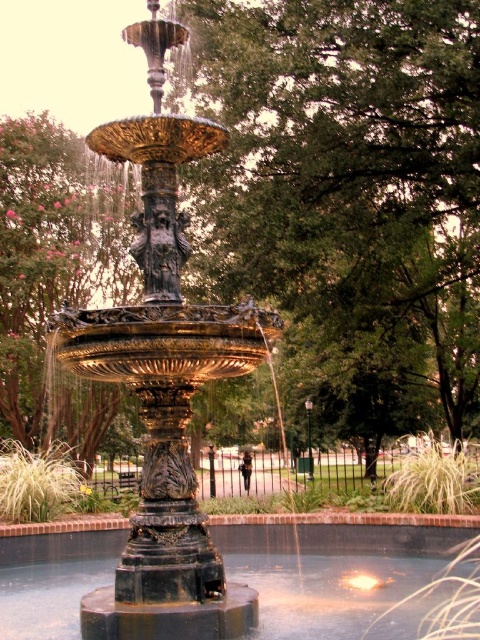
Question: Based on their relative distances, which object is nearer to the gold polished fountain at center?

Choices:
 (A) green leafy tree at left
 (B) green leafy tree at center

Answer: (B)

Question: Is green leafy tree at center positioned before black polished stone pool at center?

Choices:
 (A) no
 (B) yes

Answer: (A)

Question: Can you confirm if black polished stone pool at center is positioned above green leafy tree at left?

Choices:
 (A) yes
 (B) no

Answer: (B)

Question: Based on their relative distances, which object is nearer to the gold polished fountain at center?

Choices:
 (A) green leafy tree at center
 (B) green leafy tree at left

Answer: (A)

Question: Which of the following is the closest to the observer?

Choices:
 (A) (458, 332)
 (B) (51, 408)
 (C) (104, 618)

Answer: (C)

Question: Is green leafy tree at center above green leafy tree at left?

Choices:
 (A) yes
 (B) no

Answer: (B)